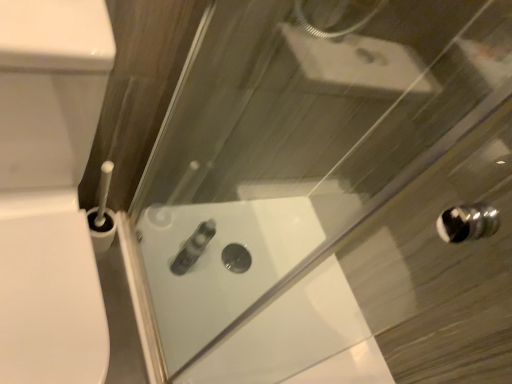
Identify the location of vacant space to the left of satin silver tube at center. This screenshot has width=512, height=384. (156, 243).